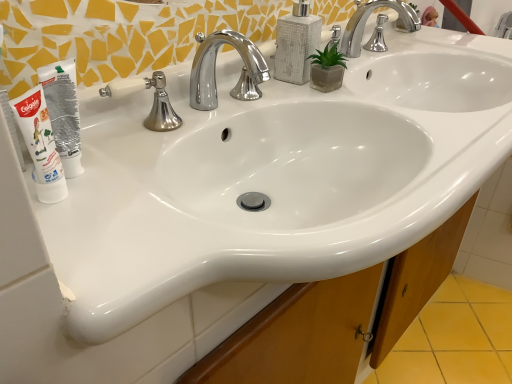
Question: Does white textured soap dispenser at upper center have a lesser height compared to silver/chrome faucet at center?

Choices:
 (A) yes
 (B) no

Answer: (B)

Question: Can you confirm if white textured soap dispenser at upper center is wider than silver/chrome faucet at center?

Choices:
 (A) yes
 (B) no

Answer: (A)

Question: From the image's perspective, would you say white textured soap dispenser at upper center is positioned over silver/chrome faucet at center?

Choices:
 (A) no
 (B) yes

Answer: (B)

Question: Is white textured soap dispenser at upper center oriented away from silver/chrome faucet at center?

Choices:
 (A) yes
 (B) no

Answer: (B)

Question: Considering the relative positions of white textured soap dispenser at upper center and silver/chrome faucet at center in the image provided, is white textured soap dispenser at upper center to the left of silver/chrome faucet at center from the viewer's perspective?

Choices:
 (A) no
 (B) yes

Answer: (A)

Question: From a real-world perspective, is white textured soap dispenser at upper center positioned under silver/chrome faucet at center based on gravity?

Choices:
 (A) yes
 (B) no

Answer: (B)

Question: Does polished chrome faucet at center, the second tap positioned from the right, lie in front of white tube at left?

Choices:
 (A) yes
 (B) no

Answer: (B)

Question: Is polished chrome faucet at center, the 2th tap when ordered from back to front, oriented towards white tube at left?

Choices:
 (A) yes
 (B) no

Answer: (B)

Question: Does polished chrome faucet at center, the 1th tap in the left-to-right sequence, have a smaller size compared to white tube at left?

Choices:
 (A) yes
 (B) no

Answer: (B)

Question: Considering the relative sizes of polished chrome faucet at center, the 1th tap in the left-to-right sequence, and white tube at left in the image provided, is polished chrome faucet at center, the 1th tap in the left-to-right sequence, bigger than white tube at left?

Choices:
 (A) yes
 (B) no

Answer: (A)

Question: From the image's perspective, does polished chrome faucet at center, the 2th tap when ordered from back to front, appear lower than white tube at left?

Choices:
 (A) yes
 (B) no

Answer: (B)

Question: Does polished chrome faucet at center, the 2th tap when ordered from back to front, have a lesser height compared to white tube at left?

Choices:
 (A) yes
 (B) no

Answer: (A)

Question: Is chrome/metallic faucet at upper center, the 2th tap viewed from the left, completely or partially outside of silver/chrome faucet at center?

Choices:
 (A) no
 (B) yes

Answer: (B)